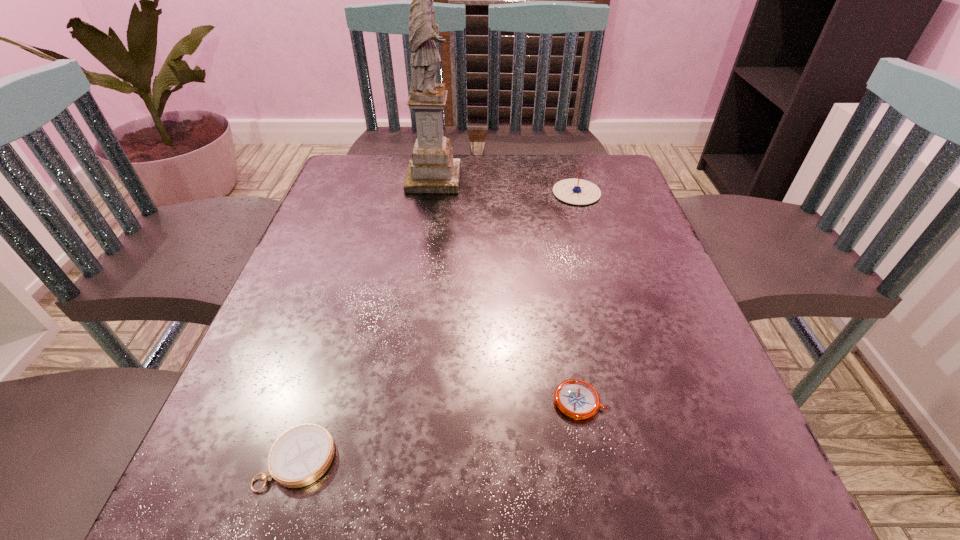
Image resolution: width=960 pixels, height=540 pixels. I want to click on sculpture, so click(432, 169).

Identify the location of the tallest object. (432, 169).

The height and width of the screenshot is (540, 960). Find the location of `the farthest compass`. the farthest compass is located at coordinates (573, 191).

Locate an element on the screen. The width and height of the screenshot is (960, 540). the third shortest object is located at coordinates (573, 191).

Locate an element on the screen. the leftmost object is located at coordinates (301, 455).

Identify the location of the nearest compass. (301, 455).

Where is `the shortest compass`? Image resolution: width=960 pixels, height=540 pixels. the shortest compass is located at coordinates (576, 399).

Identify the location of the second nearest object. Image resolution: width=960 pixels, height=540 pixels. (576, 399).

This screenshot has height=540, width=960. What are the coordinates of `vacant space situated on the front-facing side of the second object from left to right` in the screenshot? It's located at 536,179.

Image resolution: width=960 pixels, height=540 pixels. I want to click on free space located on the left of the farthest compass, so click(x=525, y=193).